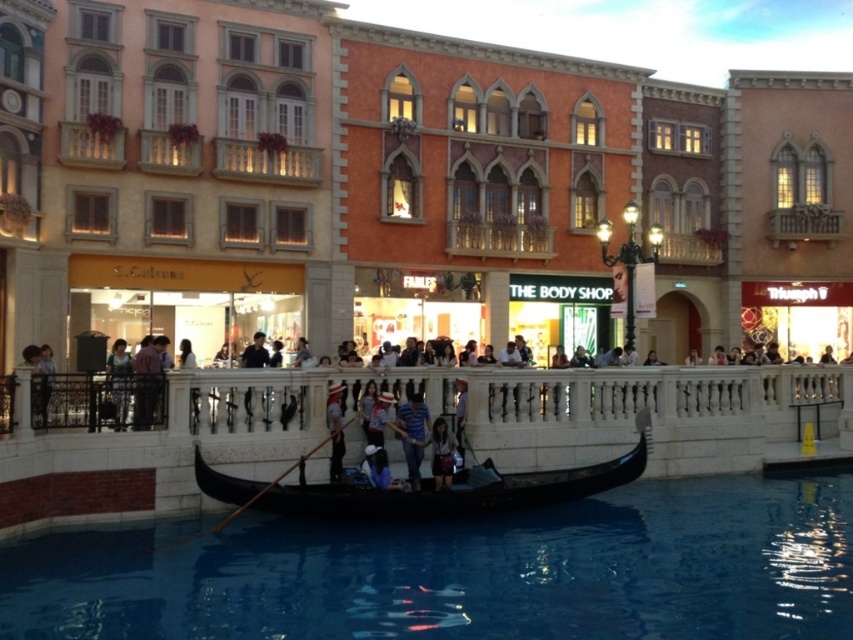
You are a photographer wanting to capture both the blue striped shirt at center and the wooden paddle at center in a single frame. Based on their sizes, which object should you focus on to ensure both are clearly visible in the photo?

The blue striped shirt at center is larger than the wooden paddle at center, so focusing on the blue striped shirt at center would allow both objects to be clearly visible in the photo.

You are standing on the dock and want to take a photo of the matte orange building at center and the transparent glass water at center. Which object will appear larger in your camera viewfinder?

The matte orange building at center will appear larger in your camera viewfinder because it is closer to you than the transparent glass water at center.